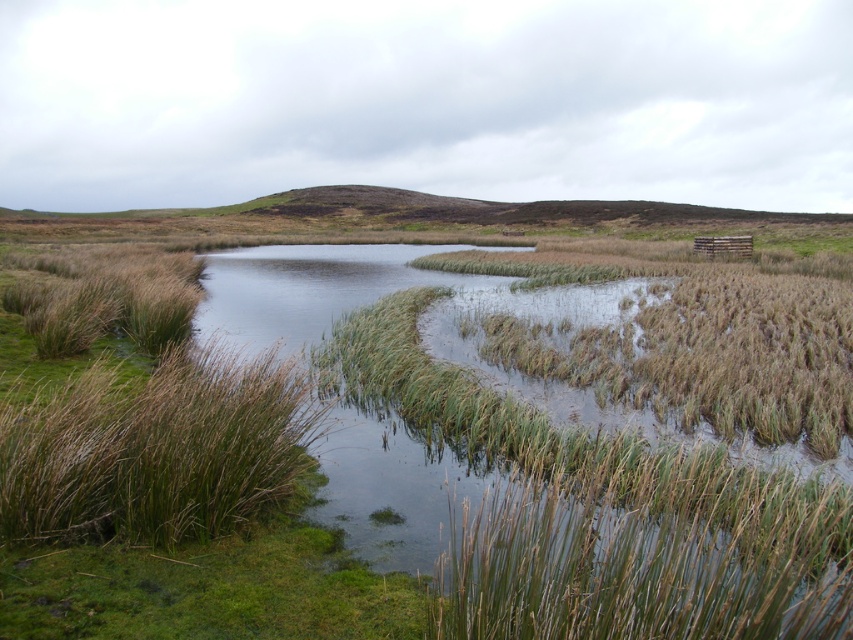
Is brown grass at lower center above brown grass at left?

Incorrect, brown grass at lower center is not positioned above brown grass at left.

Can you confirm if brown grass at lower center is smaller than brown grass at left?

Correct, brown grass at lower center occupies less space than brown grass at left.

Between point (460, 632) and point (90, 525), which one is positioned in front?

Point (460, 632) is in front.

In order to click on brown grass at lower center in this screenshot , I will do `click(624, 573)`.